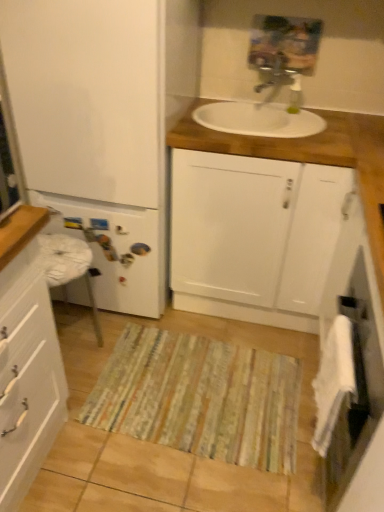
Question: Does white soft towel at lower right have a greater width compared to white matte refrigerator at left, which is the second bathroom cabinet from right to left?

Choices:
 (A) no
 (B) yes

Answer: (A)

Question: From a real-world perspective, is white soft towel at lower right under white matte refrigerator at left, which is the 2th bathroom cabinet in left-to-right order?

Choices:
 (A) yes
 (B) no

Answer: (A)

Question: Can you confirm if white soft towel at lower right is smaller than white matte refrigerator at left, which is the 2th bathroom cabinet in left-to-right order?

Choices:
 (A) no
 (B) yes

Answer: (B)

Question: Is white soft towel at lower right beside white matte refrigerator at left, which is the 2th bathroom cabinet in left-to-right order?

Choices:
 (A) yes
 (B) no

Answer: (B)

Question: Is white soft towel at lower right positioned before white matte refrigerator at left, which is the 2th bathroom cabinet in left-to-right order?

Choices:
 (A) yes
 (B) no

Answer: (A)

Question: Looking at their shapes, would you say white matte cabinet at center, which ranks as the first bathroom cabinet in right-to-left order, is wider or thinner than striped fabric doormat at center?

Choices:
 (A) thin
 (B) wide

Answer: (B)

Question: Is white matte cabinet at center, the 3th bathroom cabinet in the left-to-right sequence, taller or shorter than striped fabric doormat at center?

Choices:
 (A) tall
 (B) short

Answer: (A)

Question: Visually, is white matte cabinet at center, which ranks as the first bathroom cabinet in right-to-left order, positioned to the left or to the right of striped fabric doormat at center?

Choices:
 (A) right
 (B) left

Answer: (A)

Question: Is point (248, 313) closer or farther from the camera than point (281, 390)?

Choices:
 (A) closer
 (B) farther

Answer: (B)

Question: Looking at the image, does white matte cabinet at center, the 3th bathroom cabinet in the left-to-right sequence, seem bigger or smaller compared to white soft towel at lower right?

Choices:
 (A) small
 (B) big

Answer: (B)

Question: Does point (269, 265) appear closer or farther from the camera than point (349, 342)?

Choices:
 (A) farther
 (B) closer

Answer: (A)

Question: Considering the positions of white matte cabinet at center, which ranks as the first bathroom cabinet in right-to-left order, and white soft towel at lower right in the image, is white matte cabinet at center, which ranks as the first bathroom cabinet in right-to-left order, wider or thinner than white soft towel at lower right?

Choices:
 (A) thin
 (B) wide

Answer: (B)

Question: From the image's perspective, relative to white soft towel at lower right, is white matte cabinet at center, which ranks as the first bathroom cabinet in right-to-left order, above or below?

Choices:
 (A) above
 (B) below

Answer: (A)

Question: Considering the relative positions of metallic silver faucet at upper center and white glossy cabinet at left, which is counted as the 1th bathroom cabinet, starting from the left, in the image provided, is metallic silver faucet at upper center to the left or to the right of white glossy cabinet at left, which is counted as the 1th bathroom cabinet, starting from the left,?

Choices:
 (A) right
 (B) left

Answer: (A)

Question: In terms of width, does metallic silver faucet at upper center look wider or thinner when compared to white glossy cabinet at left, the third bathroom cabinet from the right?

Choices:
 (A) thin
 (B) wide

Answer: (A)